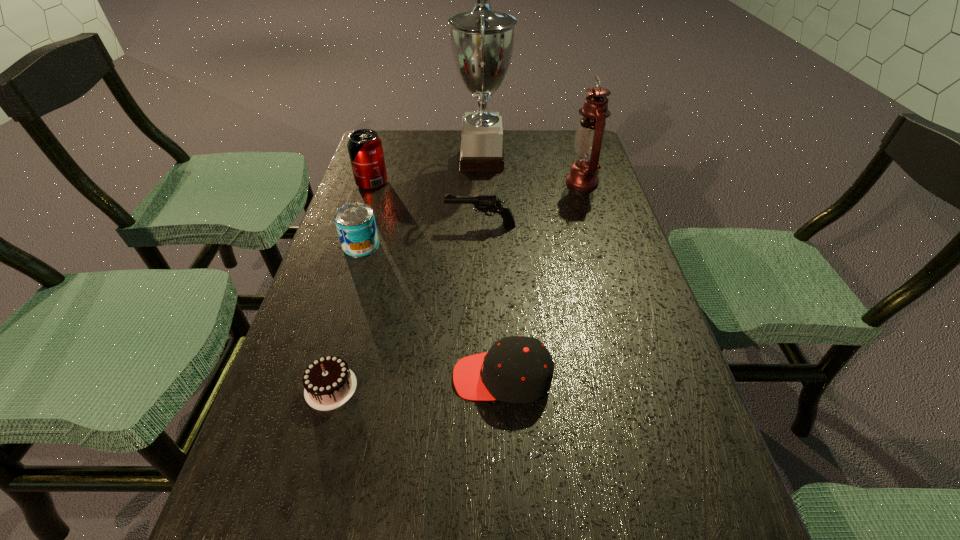
Locate an element on the screen. This screenshot has width=960, height=540. free region located on the front of the shortest object is located at coordinates (301, 494).

Locate an element on the screen. Image resolution: width=960 pixels, height=540 pixels. object that is at the far edge is located at coordinates (482, 40).

You are a GUI agent. You are given a task and a screenshot of the screen. Output one action in this format:
    pyautogui.click(x=<x>, y=<y>)
    Task: Click on the soda can at the left edge
    The image size is (960, 540).
    Given the screenshot: What is the action you would take?
    pyautogui.click(x=365, y=149)

What are the coordinates of `can that is at the left edge` in the screenshot? It's located at (355, 222).

Where is `chocolate cake situated at the left edge`? The image size is (960, 540). chocolate cake situated at the left edge is located at coordinates (329, 383).

Image resolution: width=960 pixels, height=540 pixels. I want to click on object that is at the right edge, so click(x=590, y=136).

Find the location of a particular element. The image size is (960, 540). vacant space at the far edge of the desktop is located at coordinates (441, 154).

Where is `vacant position at the left edge of the desktop`? vacant position at the left edge of the desktop is located at coordinates (398, 207).

At what (x,y) coordinates should I click in order to perform the action: click on vacant position at the right edge of the desktop. Please return your answer as a coordinate pair (x, y). Looking at the image, I should click on (627, 371).

Image resolution: width=960 pixels, height=540 pixels. Find the location of `vacant area that lies between the shortest object and the cap`. vacant area that lies between the shortest object and the cap is located at coordinates (417, 382).